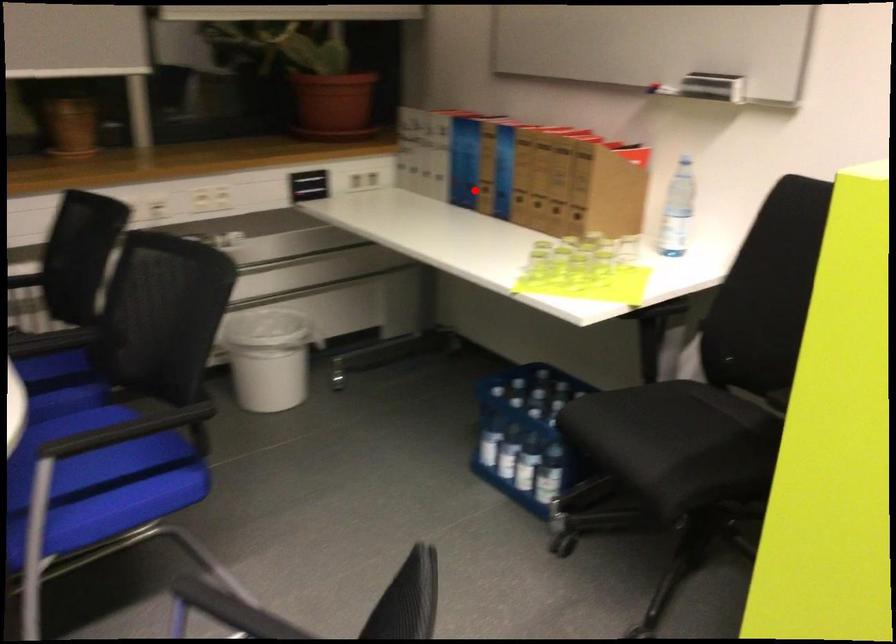
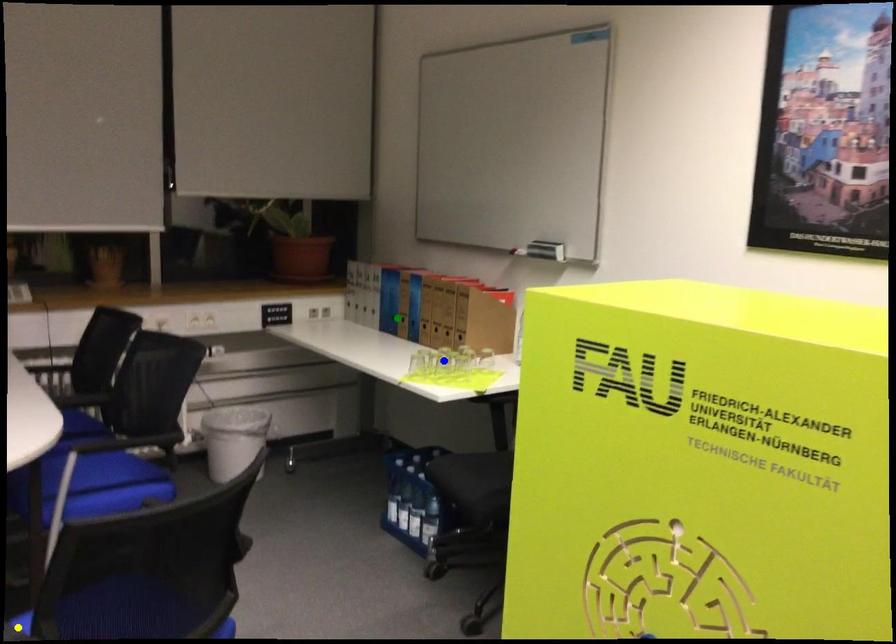
Question: I am providing you with two images of the same scene from different viewpoints. A red point is marked on the first image. You are given multiple points on the second image. Which point in image 2 is actually the same real-world point as the red point in image 1?

Choices:
 (A) green point
 (B) blue point
 (C) yellow point

Answer: (A)